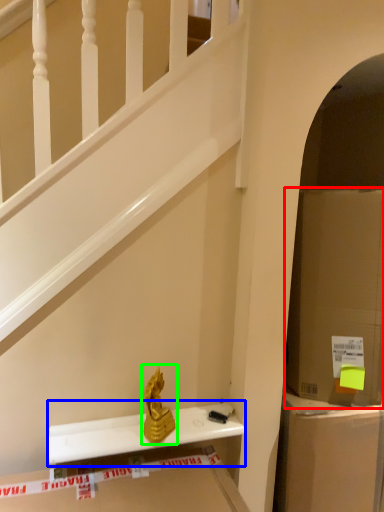
Question: Estimate the real-world distances between objects in this image. Which object is farther from cardboard box (highlighted by a red box), window sill (highlighted by a blue box) or sculpture (highlighted by a green box)?

Choices:
 (A) window sill
 (B) sculpture

Answer: (B)